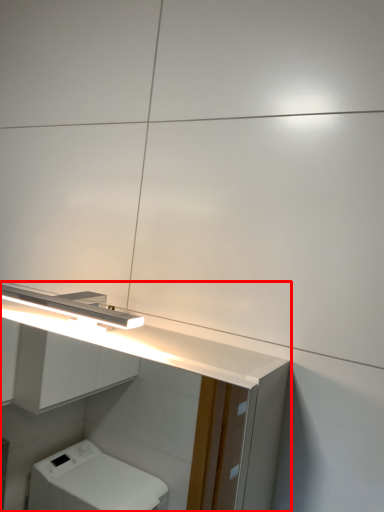
Question: From the image's perspective, what is the correct spatial relationship of bathroom cabinet (annotated by the red box) in relation to light fixture?

Choices:
 (A) above
 (B) below

Answer: (B)